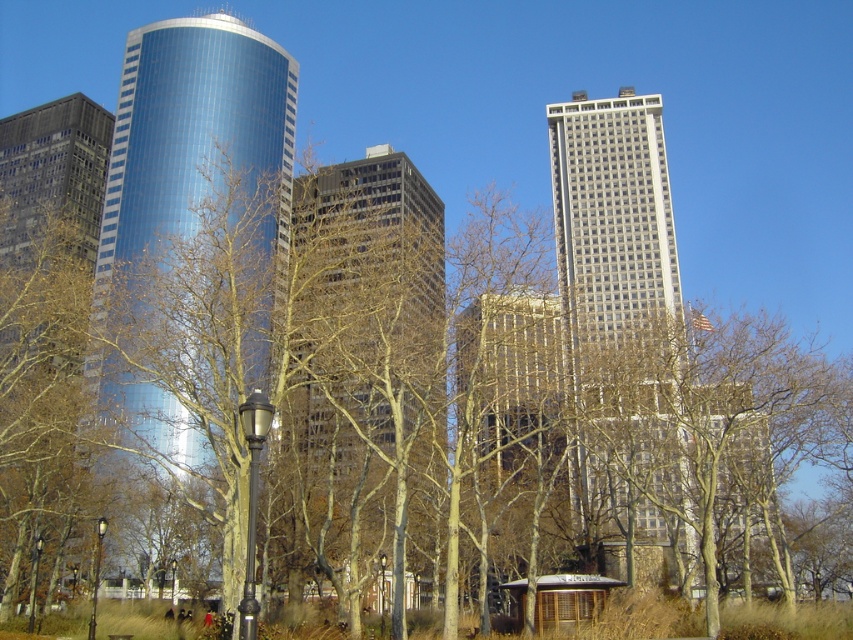
Is brown glassy building at center positioned in front of gray glass skyscraper at center?

Yes, brown glassy building at center is in front of gray glass skyscraper at center.

Is brown glassy building at center above gray glass skyscraper at center?

Actually, brown glassy building at center is below gray glass skyscraper at center.

Is point (335, 483) less distant than point (648, 118)?

Yes, point (335, 483) is closer to viewer.

Where is `brown glassy building at center`? brown glassy building at center is located at coordinates (363, 344).

Is glossy glass tower at center shorter than gray glass skyscraper at center?

Incorrect, glossy glass tower at center's height does not fall short of gray glass skyscraper at center's.

Who is shorter, glossy glass tower at center or gray glass skyscraper at center?

Standing shorter between the two is gray glass skyscraper at center.

Measure the distance between point (151, 428) and camera.

The distance of point (151, 428) from camera is 88.63 meters.

Where is `glossy glass tower at center`? This screenshot has height=640, width=853. glossy glass tower at center is located at coordinates (195, 129).

Does brown glassy building at center appear over glossy glass tower at center?

Actually, brown glassy building at center is below glossy glass tower at center.

Identify the location of brown glassy building at center. Image resolution: width=853 pixels, height=640 pixels. (363, 344).

In order to click on brown glassy building at center in this screenshot , I will do `click(363, 344)`.